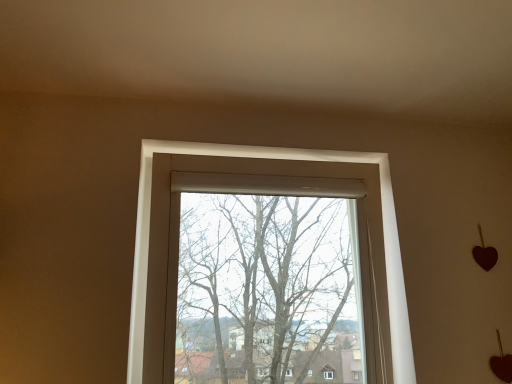
Identify the location of transparent glass window at center. point(277,159).

What is the approximate height of transparent glass window at center?

transparent glass window at center is 31.73 inches in height.

What do you see at coordinates (277, 159) in the screenshot? Image resolution: width=512 pixels, height=384 pixels. I see `transparent glass window at center` at bounding box center [277, 159].

Measure the distance between transparent glass window at center and camera.

transparent glass window at center is 4.09 feet from camera.

Image resolution: width=512 pixels, height=384 pixels. Identify the location of transparent glass window at center. (277, 159).